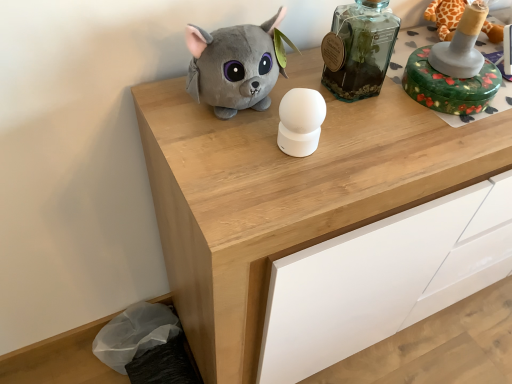
You are a GUI agent. You are given a task and a screenshot of the screen. Output one action in this format:
    pyautogui.click(x=<x>, y=<y>)
    Task: Click on the vacant space in front of green floral-patterned box at upper right, the 1th toy when ordered from right to left
    Image resolution: width=512 pixels, height=384 pixels.
    Given the screenshot: What is the action you would take?
    pyautogui.click(x=444, y=140)